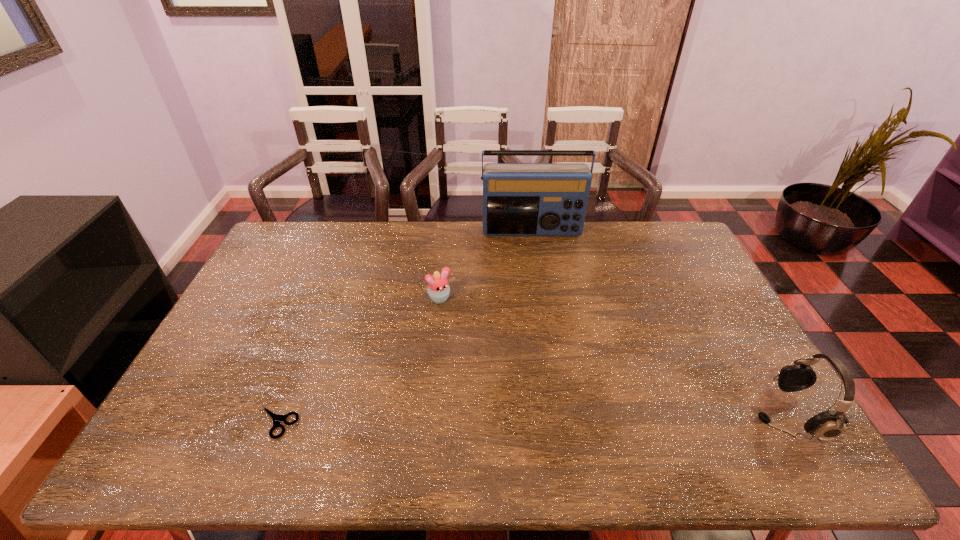
Image resolution: width=960 pixels, height=540 pixels. Identify the location of the leftmost object. (276, 418).

Find the location of `the shortest object`. the shortest object is located at coordinates [276, 418].

Identify the location of headset. (828, 425).

Where is `the rightmost object`? Image resolution: width=960 pixels, height=540 pixels. the rightmost object is located at coordinates (828, 425).

Where is `the second shortest object`? The width and height of the screenshot is (960, 540). the second shortest object is located at coordinates (438, 287).

The height and width of the screenshot is (540, 960). Identify the location of the third object from right to left. (438, 287).

Identify the location of the tallest object. (519, 199).

This screenshot has height=540, width=960. I want to click on radio receiver, so click(x=519, y=199).

The height and width of the screenshot is (540, 960). What are the coordinates of `vacant space situated 0.120m on the right of the leftmost object` in the screenshot? It's located at (348, 422).

Where is `vacant region located 0.270m with the microphone on the side of the second tallest object`? The height and width of the screenshot is (540, 960). vacant region located 0.270m with the microphone on the side of the second tallest object is located at coordinates (646, 414).